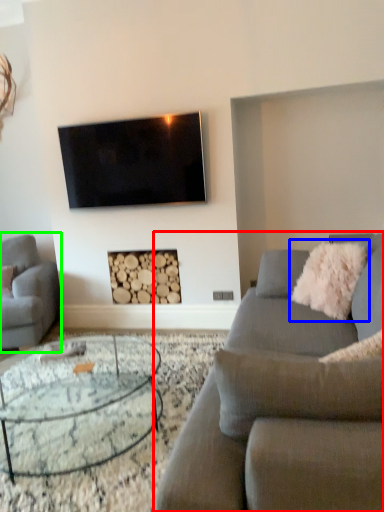
Question: Estimate the real-world distances between objects in this image. Which object is farther from studio couch (highlighted by a red box), pillow (highlighted by a blue box) or studio couch (highlighted by a green box)?

Choices:
 (A) pillow
 (B) studio couch

Answer: (B)